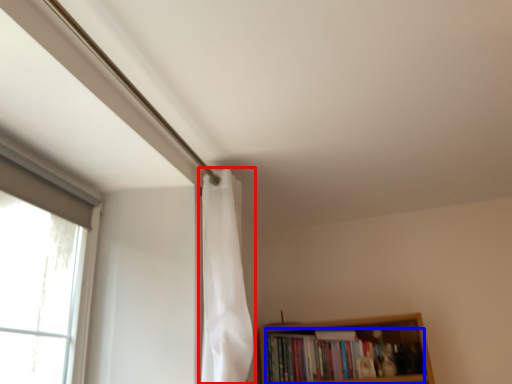
Question: Among these objects, which one is farthest to the camera, shower curtain (highlighted by a red box) or book (highlighted by a blue box)?

Choices:
 (A) shower curtain
 (B) book

Answer: (B)